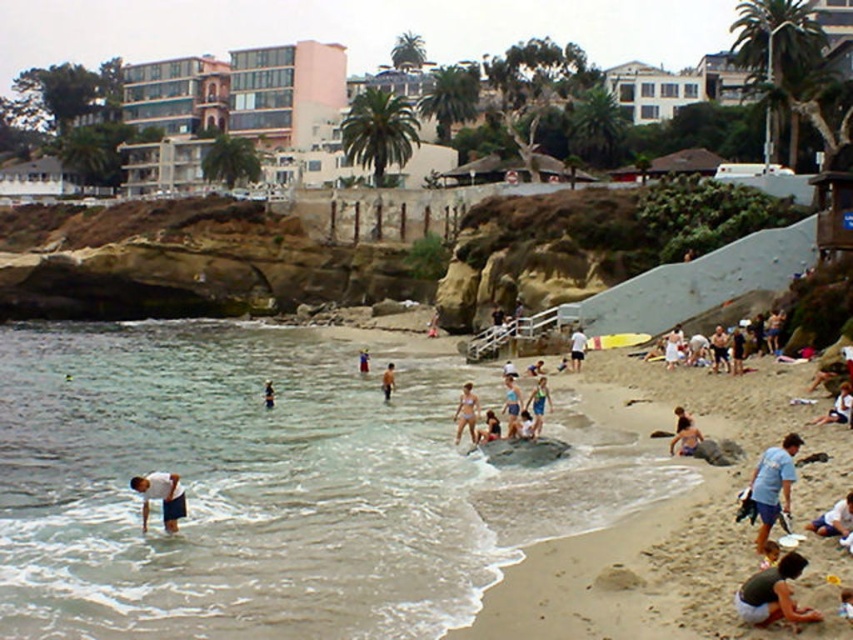
Is beige sandy beach at lower right positioned before white fabric surfboard at center?

Yes, beige sandy beach at lower right is in front of white fabric surfboard at center.

Between beige sandy beach at lower right and white fabric surfboard at center, which one appears on the right side from the viewer's perspective?

Positioned to the right is beige sandy beach at lower right.

Who is more distant from viewer, (529, 580) or (578, 349)?

The point (578, 349) is more distant.

At what (x,y) coordinates should I click in order to perform the action: click on beige sandy beach at lower right. Please return your answer as a coordinate pair (x, y). This screenshot has width=853, height=640. Looking at the image, I should click on (662, 516).

Measure the distance between point [782,595] and camera.

A distance of 137.81 feet exists between point [782,595] and camera.

In order to click on dark green fabric at lower right in this screenshot , I will do `click(773, 595)`.

Measure the distance from white matte shorts at lower left to light blue fabric at lower right.

white matte shorts at lower left and light blue fabric at lower right are 33.51 meters apart.

Does white matte shorts at lower left appear under light blue fabric at lower right?

Correct, white matte shorts at lower left is located below light blue fabric at lower right.

Identify the location of white matte shorts at lower left. The image size is (853, 640). (160, 497).